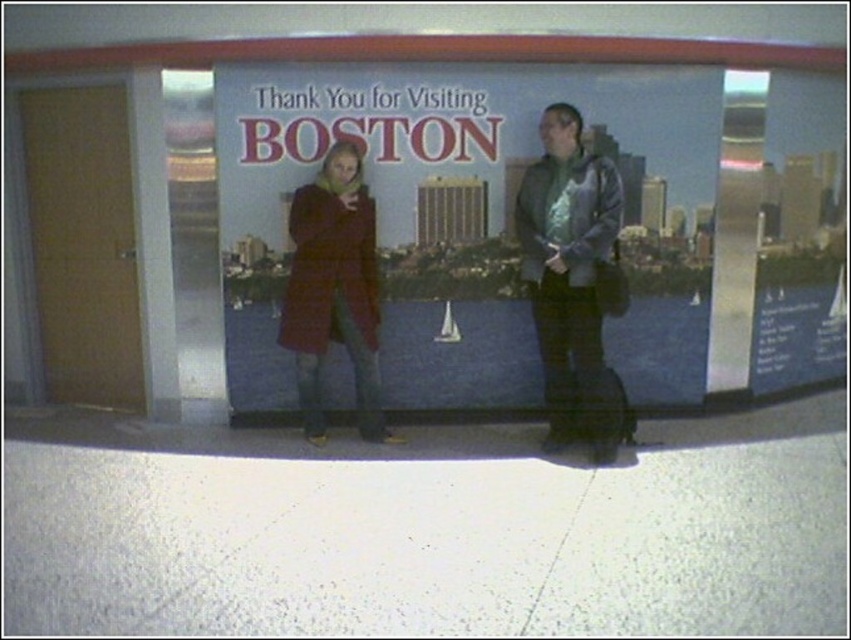
Is point (484, 124) positioned in front of point (612, 221)?

No, it is not.

Which is in front, point (494, 195) or point (549, 218)?

Point (549, 218) is in front.

You are a GUI agent. You are given a task and a screenshot of the screen. Output one action in this format:
    pyautogui.click(x=<x>, y=<y>)
    Task: Click on the matte plastic poster at center
    This screenshot has width=851, height=640.
    Given the screenshot: What is the action you would take?
    pyautogui.click(x=471, y=218)

In order to click on matte plastic poster at center in this screenshot , I will do `click(471, 218)`.

Between point (690, 381) and point (310, 413), which one is positioned behind?

Point (690, 381)

Is matte plastic poster at center to the left of matte red coat at center from the viewer's perspective?

In fact, matte plastic poster at center is to the right of matte red coat at center.

Is point (621, 244) less distant than point (380, 442)?

That is False.

At what (x,y) coordinates should I click in order to perform the action: click on matte plastic poster at center. Please return your answer as a coordinate pair (x, y). This screenshot has height=640, width=851. Looking at the image, I should click on (471, 218).

Who is taller, metallic silver jacket at right or matte red coat at center?

metallic silver jacket at right is taller.

From the picture: Who is shorter, metallic silver jacket at right or matte red coat at center?

matte red coat at center is shorter.

This screenshot has width=851, height=640. Find the location of `metallic silver jacket at right`. metallic silver jacket at right is located at coordinates (570, 278).

The height and width of the screenshot is (640, 851). I want to click on metallic silver jacket at right, so click(x=570, y=278).